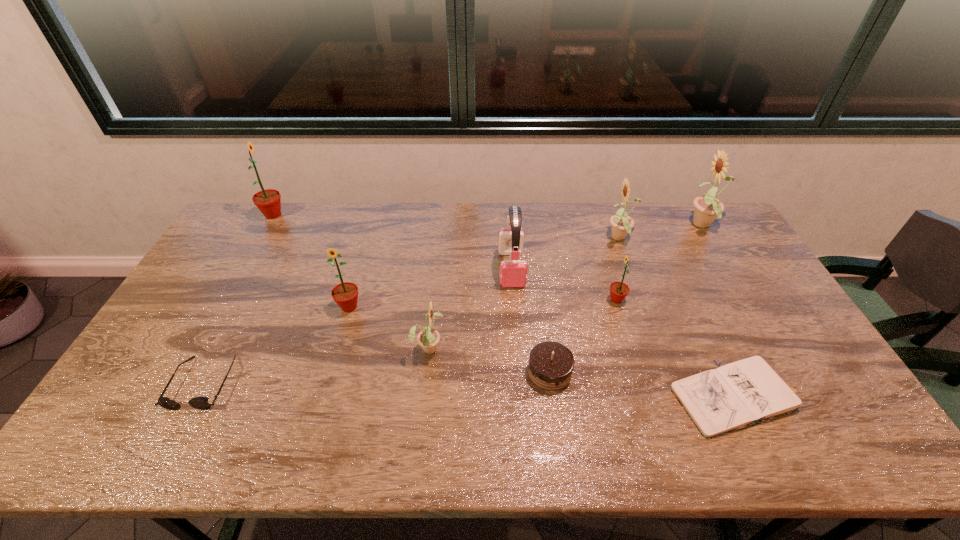
Locate an element on the screen. The image size is (960, 540). vacant position located 0.090m on the front-facing side of the ninth tallest object is located at coordinates (170, 447).

Locate an element on the screen. Image resolution: width=960 pixels, height=540 pixels. vacant space situated on the left of the shortest object is located at coordinates (589, 397).

Locate an element on the screen. object that is at the near edge is located at coordinates (746, 392).

Identify the location of sunflower that is at the left edge. The width and height of the screenshot is (960, 540). (268, 201).

Find the location of a particular element. sunglasses present at the left edge is located at coordinates (201, 403).

Where is `sunflower that is at the right edge`? sunflower that is at the right edge is located at coordinates tap(707, 208).

Locate an element on the screen. The width and height of the screenshot is (960, 540). notebook that is at the right edge is located at coordinates (746, 392).

This screenshot has height=540, width=960. What are the coordinates of `object present at the far left corner` in the screenshot? It's located at (268, 201).

Find the location of a particular element. object that is at the far right corner is located at coordinates (707, 208).

Find the location of a particular element. Image resolution: width=960 pixels, height=540 pixels. object that is at the near right corner is located at coordinates (746, 392).